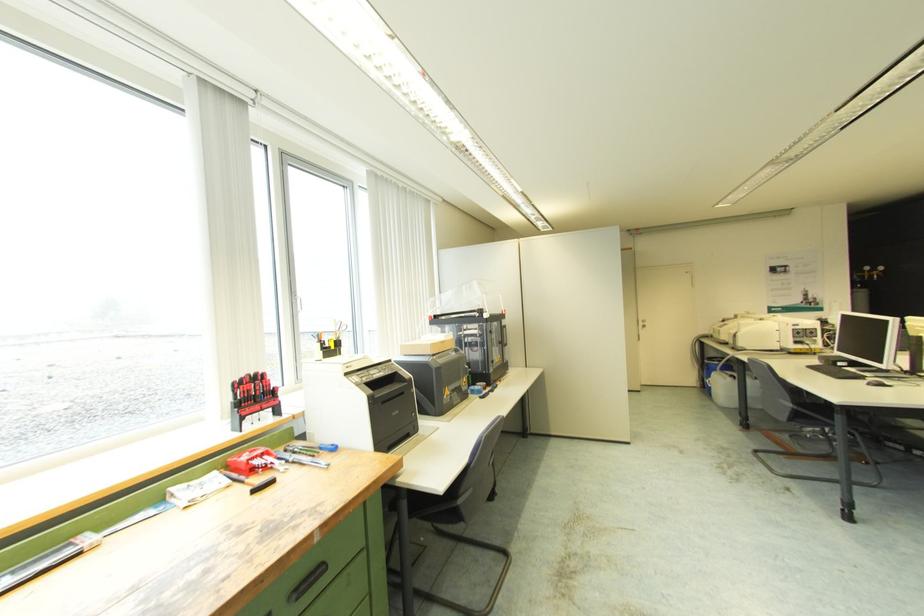
Find the location of a particular element. Image resolution: width=924 pixels, height=616 pixels. white blind wand is located at coordinates click(x=411, y=90).